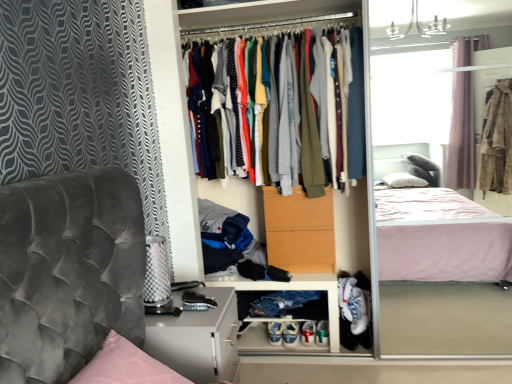
Question: Is matte orange drawer at center facing towards multicolored fabric shirts at center?

Choices:
 (A) no
 (B) yes

Answer: (A)

Question: Considering the relative sizes of matte orange drawer at center and multicolored fabric shirts at center in the image provided, is matte orange drawer at center smaller than multicolored fabric shirts at center?

Choices:
 (A) yes
 (B) no

Answer: (A)

Question: Is matte orange drawer at center surrounding multicolored fabric shirts at center?

Choices:
 (A) yes
 (B) no

Answer: (B)

Question: Is the depth of matte orange drawer at center less than that of multicolored fabric shirts at center?

Choices:
 (A) yes
 (B) no

Answer: (B)

Question: Considering the relative sizes of matte orange drawer at center and multicolored fabric shirts at center in the image provided, is matte orange drawer at center wider than multicolored fabric shirts at center?

Choices:
 (A) yes
 (B) no

Answer: (B)

Question: Relative to matte orange drawer at center, is multicolored fabric shirts at center in front or behind?

Choices:
 (A) behind
 (B) front

Answer: (B)

Question: Is multicolored fabric shirts at center to the left or to the right of matte orange drawer at center in the image?

Choices:
 (A) left
 (B) right

Answer: (A)

Question: From a real-world perspective, is multicolored fabric shirts at center positioned above or below matte orange drawer at center?

Choices:
 (A) above
 (B) below

Answer: (A)

Question: From the image's perspective, is multicolored fabric shirts at center positioned above or below matte orange drawer at center?

Choices:
 (A) below
 (B) above

Answer: (B)

Question: From the image's perspective, relative to matte white dresser at center, is matte orange drawer at center above or below?

Choices:
 (A) above
 (B) below

Answer: (B)

Question: From their relative heights in the image, would you say matte orange drawer at center is taller or shorter than matte white dresser at center?

Choices:
 (A) tall
 (B) short

Answer: (B)

Question: In terms of size, does matte orange drawer at center appear bigger or smaller than matte white dresser at center?

Choices:
 (A) small
 (B) big

Answer: (A)

Question: Is point (279, 228) closer or farther from the camera than point (248, 19)?

Choices:
 (A) closer
 (B) farther

Answer: (A)

Question: From the image's perspective, is multicolored fabric shirts at center located above or below matte white dresser at center?

Choices:
 (A) above
 (B) below

Answer: (A)

Question: Is multicolored fabric shirts at center inside or outside of matte white dresser at center?

Choices:
 (A) inside
 (B) outside

Answer: (A)